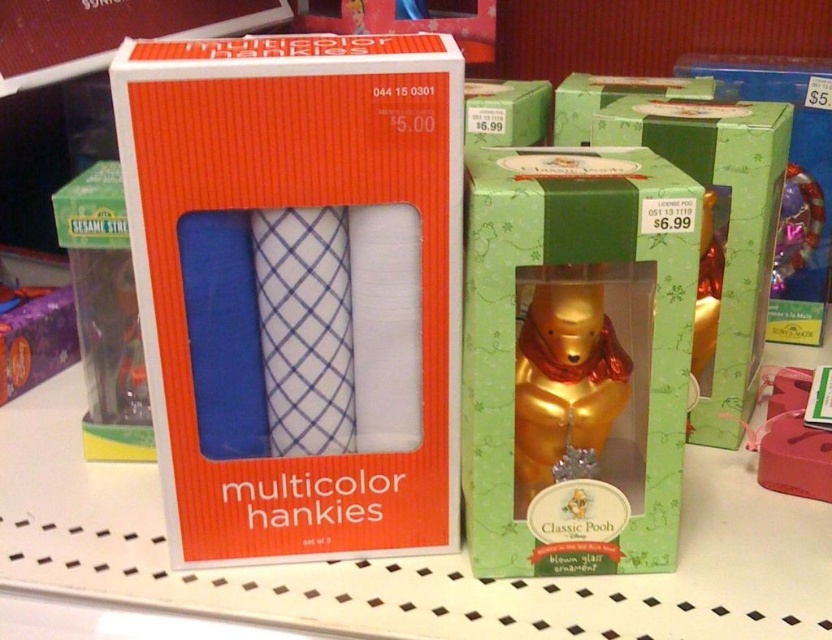
Question: Is orange matte box of multicolor hankies at center in front of green paper box at center?

Choices:
 (A) yes
 (B) no

Answer: (A)

Question: Which point is farther to the camera?

Choices:
 (A) orange matte box of multicolor hankies at center
 (B) metallic gold bear at center
 (C) green plastic toy at left

Answer: (C)

Question: Considering the relative positions of orange matte box of multicolor hankies at center and green paper box at center in the image provided, where is orange matte box of multicolor hankies at center located with respect to green paper box at center?

Choices:
 (A) below
 (B) above

Answer: (A)

Question: Which point is closer to the camera?

Choices:
 (A) (543, 378)
 (B) (157, 428)
 (C) (721, 129)

Answer: (B)

Question: Does metallic gold bear at center have a lesser width compared to green plastic toy at left?

Choices:
 (A) no
 (B) yes

Answer: (A)

Question: Based on their relative distances, which object is farther from the orange matte box of multicolor hankies at center?

Choices:
 (A) green plastic toy at left
 (B) gold metallic bear at center
 (C) metallic gold bear at center

Answer: (C)